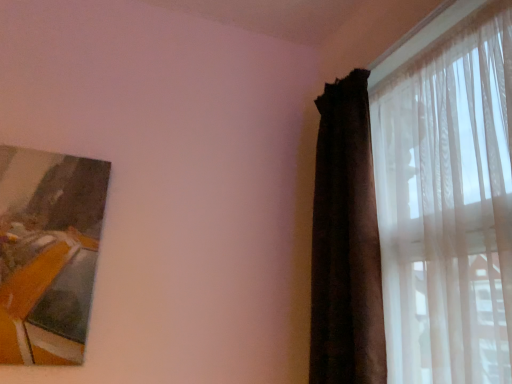
Question: From the image's perspective, does translucent sheer curtain at right, placed as the first curtain when sorted from right to left, appear lower than wooden frame at upper left?

Choices:
 (A) no
 (B) yes

Answer: (A)

Question: Is the depth of translucent sheer curtain at right, the 2th curtain when ordered from left to right, greater than that of wooden frame at upper left?

Choices:
 (A) yes
 (B) no

Answer: (B)

Question: Does translucent sheer curtain at right, the 2th curtain when ordered from left to right, come in front of wooden frame at upper left?

Choices:
 (A) no
 (B) yes

Answer: (B)

Question: Is translucent sheer curtain at right, the 2th curtain when ordered from left to right, bigger than wooden frame at upper left?

Choices:
 (A) yes
 (B) no

Answer: (A)

Question: Is translucent sheer curtain at right, placed as the first curtain when sorted from right to left, positioned with its back to wooden frame at upper left?

Choices:
 (A) no
 (B) yes

Answer: (A)

Question: Can you confirm if translucent sheer curtain at right, placed as the first curtain when sorted from right to left, is taller than wooden frame at upper left?

Choices:
 (A) yes
 (B) no

Answer: (A)

Question: Can you confirm if dark velvet curtain at right, placed as the 1th curtain when sorted from left to right, is wider than wooden frame at upper left?

Choices:
 (A) no
 (B) yes

Answer: (B)

Question: Is dark velvet curtain at right, placed as the 1th curtain when sorted from left to right, closer to camera compared to wooden frame at upper left?

Choices:
 (A) yes
 (B) no

Answer: (B)

Question: Is dark velvet curtain at right, placed as the 1th curtain when sorted from left to right, looking in the opposite direction of wooden frame at upper left?

Choices:
 (A) no
 (B) yes

Answer: (A)

Question: From the image's perspective, is dark velvet curtain at right, which ranks as the 2th curtain in right-to-left order, on top of wooden frame at upper left?

Choices:
 (A) yes
 (B) no

Answer: (A)

Question: Is the surface of dark velvet curtain at right, placed as the 1th curtain when sorted from left to right, in direct contact with wooden frame at upper left?

Choices:
 (A) no
 (B) yes

Answer: (A)

Question: Is dark velvet curtain at right, placed as the 1th curtain when sorted from left to right, not within wooden frame at upper left?

Choices:
 (A) yes
 (B) no

Answer: (A)

Question: Is dark velvet curtain at right, placed as the 1th curtain when sorted from left to right, smaller than translucent sheer curtain at right, the 2th curtain when ordered from left to right?

Choices:
 (A) yes
 (B) no

Answer: (A)